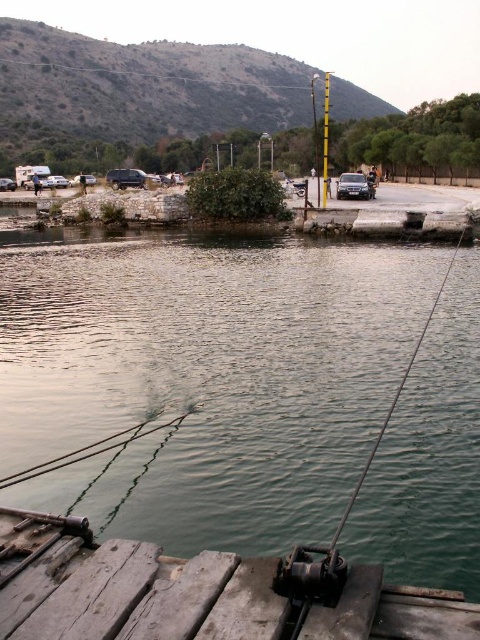
Question: Which object is positioned farthest from the yellow painted metal pole at center?

Choices:
 (A) smooth wire fishing rod at center
 (B) weathered wood dock at lower left

Answer: (A)

Question: Can you confirm if weathered wood dock at lower left is positioned to the right of yellow painted metal pole at center?

Choices:
 (A) yes
 (B) no

Answer: (B)

Question: Which point is farther to the camera?

Choices:
 (A) (324, 177)
 (B) (20, 550)
 (C) (437, 292)
 (D) (467, 509)

Answer: (A)

Question: Is greenish water at center thinner than smooth wire fishing rod at center?

Choices:
 (A) yes
 (B) no

Answer: (B)

Question: Does smooth wire fishing rod at center have a lesser width compared to yellow painted metal pole at center?

Choices:
 (A) no
 (B) yes

Answer: (B)

Question: Which point is farther to the camera?

Choices:
 (A) greenish water at center
 (B) weathered wood dock at lower left
 (C) smooth wire fishing rod at center
 (D) yellow painted metal pole at center

Answer: (D)